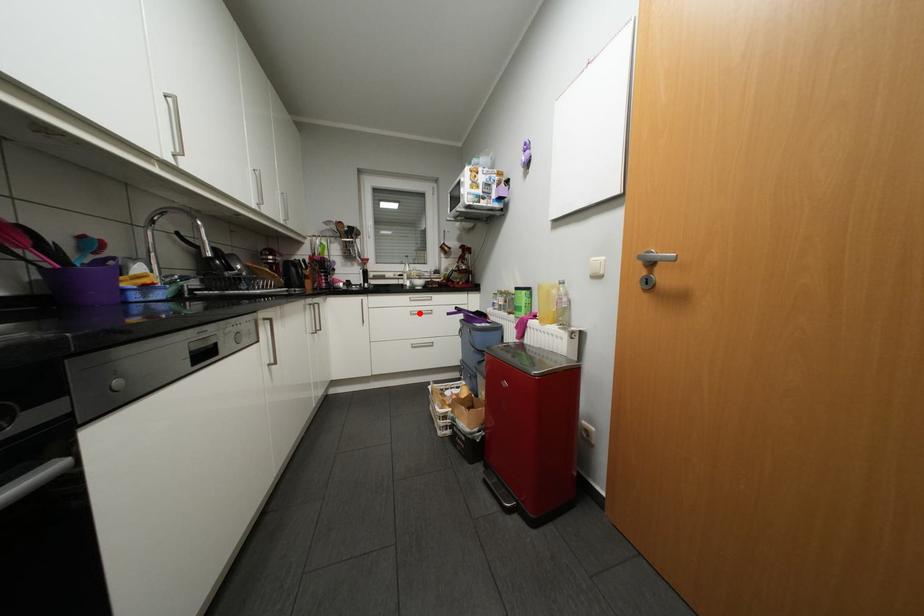
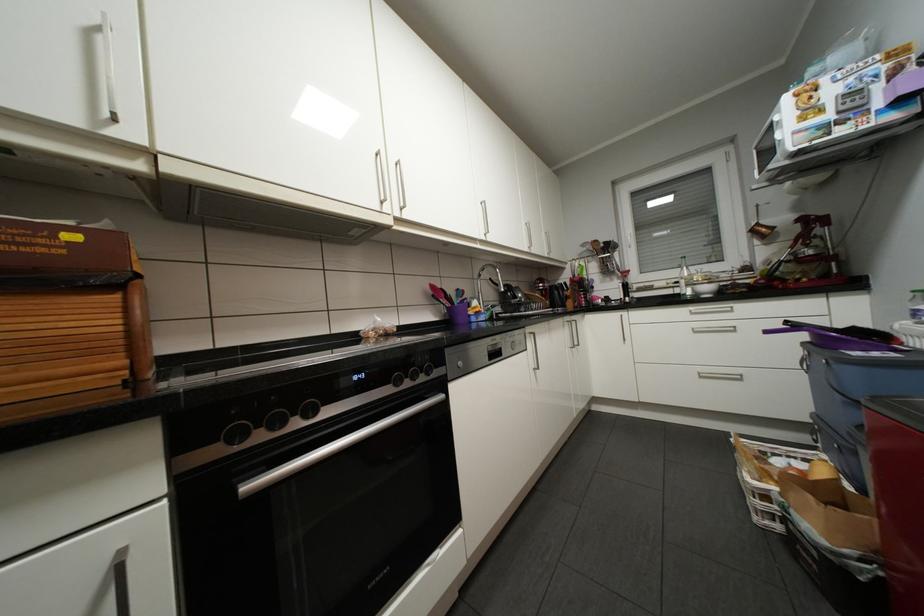
Locate, in the second image, the point that corresponds to the highlighted location in the first image.

(703, 331)